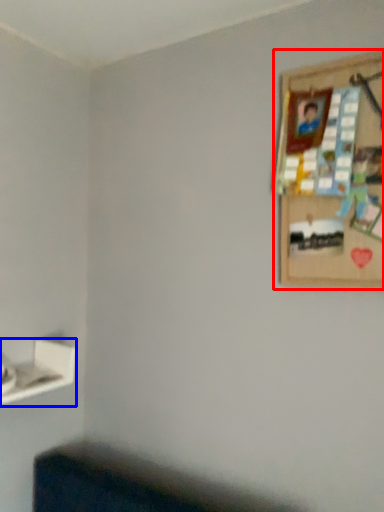
Question: Which point is further to the camera, picture frame (highlighted by a red box) or shelf (highlighted by a blue box)?

Choices:
 (A) picture frame
 (B) shelf

Answer: (B)